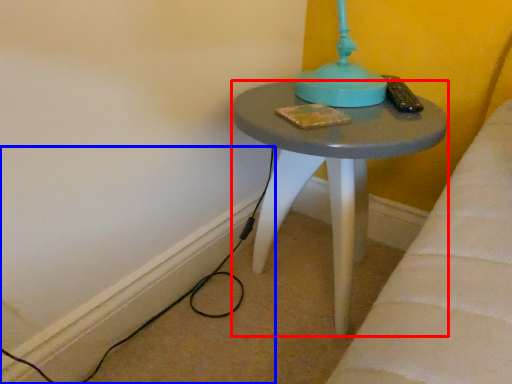
Question: Which of the following is the closest to the observer, stool (highlighted by a red box) or cable (highlighted by a blue box)?

Choices:
 (A) stool
 (B) cable

Answer: (A)